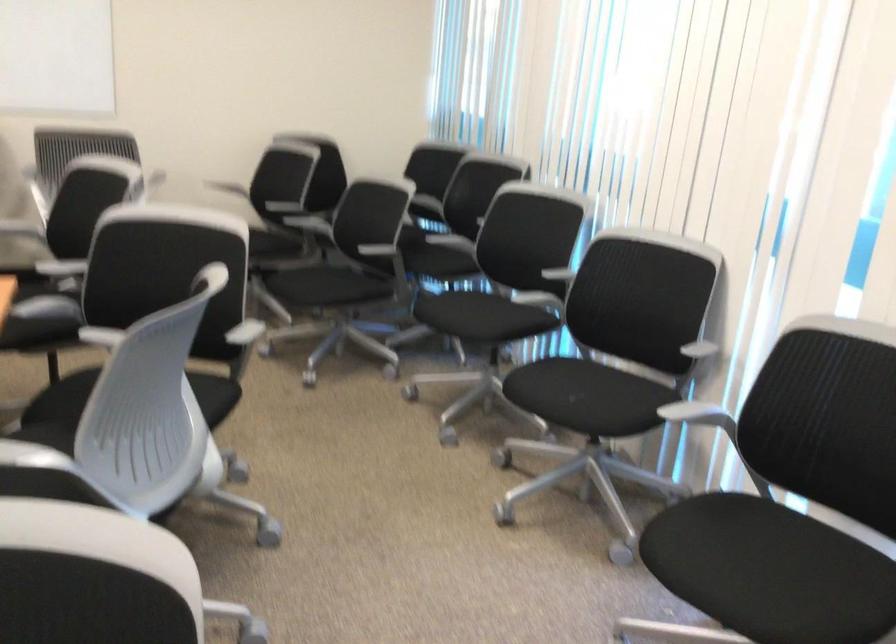
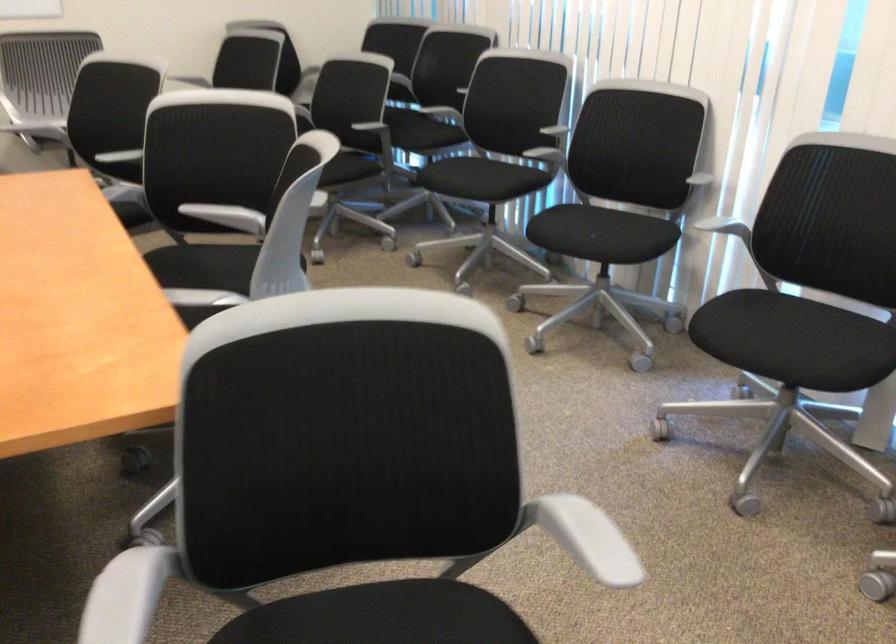
In the second image, find the point that corresponds to the point at 694,346 in the first image.

(693, 174)